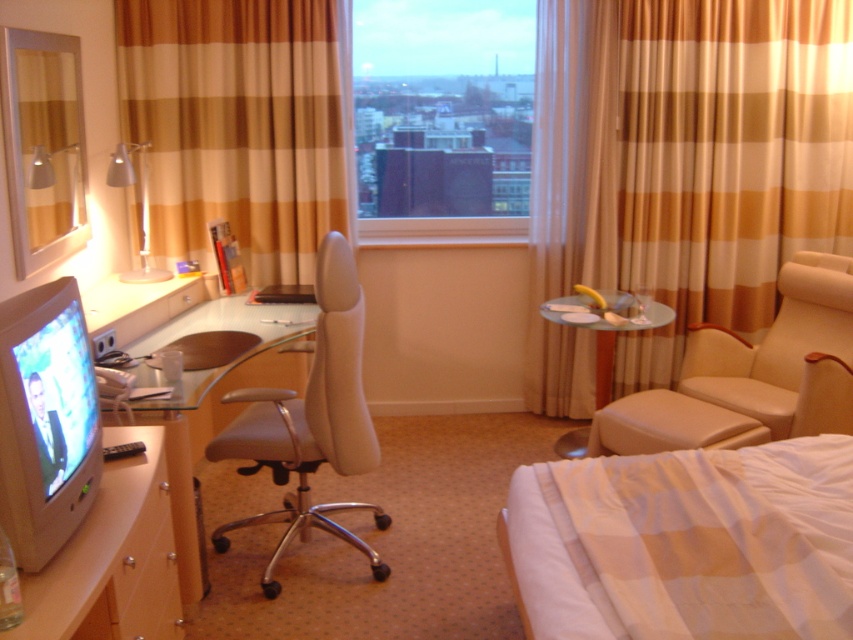
Does white checkered bed at lower right appear on the left side of clear glass table at center?

Indeed, white checkered bed at lower right is positioned on the left side of clear glass table at center.

This screenshot has height=640, width=853. Find the location of `white checkered bed at lower right`. white checkered bed at lower right is located at coordinates (688, 541).

Is point (502, 4) positioned before point (616, 67)?

No.

Which is above, transparent glass window at center or beige striped curtain at right?

transparent glass window at center is above.

Is point (509, 6) positioned before point (569, 152)?

No, (509, 6) is further to viewer.

In order to click on transparent glass window at center in this screenshot , I will do `click(442, 118)`.

Is beige leather swivel chair at center in front of matte white desk at center?

That is False.

You are a GUI agent. You are given a task and a screenshot of the screen. Output one action in this format:
    pyautogui.click(x=<x>, y=<y>)
    Task: Click on the beige leather swivel chair at center
    This screenshot has height=640, width=853.
    Given the screenshot: What is the action you would take?
    pyautogui.click(x=310, y=419)

The image size is (853, 640). Find the location of `beige leather swivel chair at center`. beige leather swivel chair at center is located at coordinates (310, 419).

Locate an element on the screen. This screenshot has width=853, height=640. beige leather swivel chair at center is located at coordinates tap(310, 419).